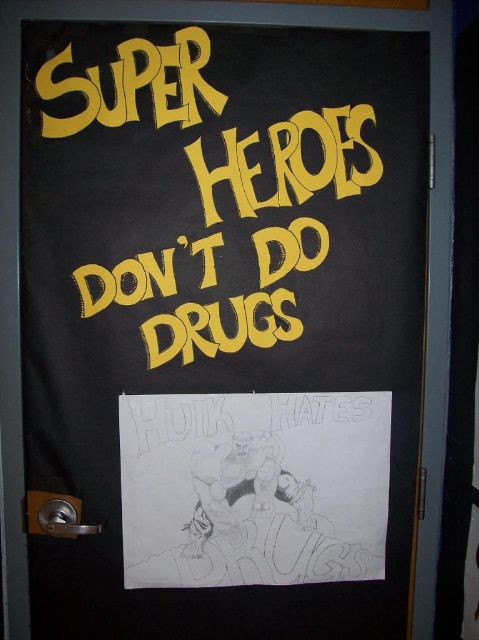
Between point (343, 465) and point (274, 272), which one is positioned behind?

Positioned behind is point (343, 465).

Is point (212, 500) more distant than point (253, 308)?

Yes, it is behind point (253, 308).

The width and height of the screenshot is (479, 640). In order to click on graphite sketch at center in this screenshot , I will do `click(253, 486)`.